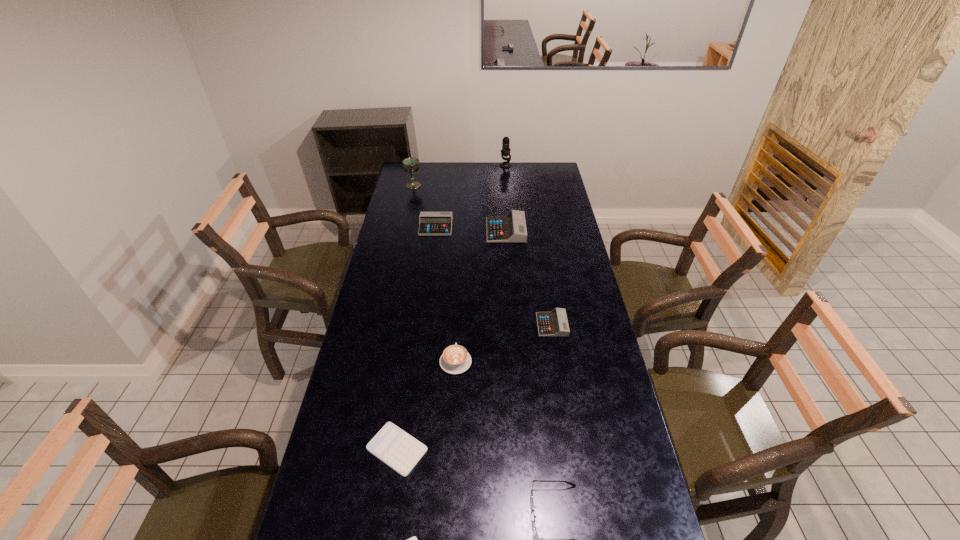
Identify which gray calculator is the second closest to the third tallest calculator. Please provide its 2D coordinates. Your answer should be formatted as a tuple, i.e. [(x, y)], where the tuple contains the x and y coordinates of a point satisfying the conditions above.

[(431, 223)]

You are a GUI agent. You are given a task and a screenshot of the screen. Output one action in this format:
    pyautogui.click(x=<x>, y=<y>)
    Task: Click on the gray calculator that is the second closest to the fifth nearest object
    
    Given the screenshot: What is the action you would take?
    pyautogui.click(x=431, y=223)

This screenshot has height=540, width=960. In order to click on vacant point that satisfies the following two spatial constraints: 1. on the back side of the farther white calculator; 2. on the left side of the black microphone in this screenshot , I will do `click(439, 166)`.

Where is `vacant region that satisfies the following two spatial constraints: 1. on the back side of the eighth nearest object; 2. on the right side of the farthest object`? The width and height of the screenshot is (960, 540). vacant region that satisfies the following two spatial constraints: 1. on the back side of the eighth nearest object; 2. on the right side of the farthest object is located at coordinates (418, 166).

The image size is (960, 540). In order to click on free location that satisfies the following two spatial constraints: 1. on the front side of the second farthest object; 2. on the left side of the third shortest calculator in this screenshot , I will do `click(383, 325)`.